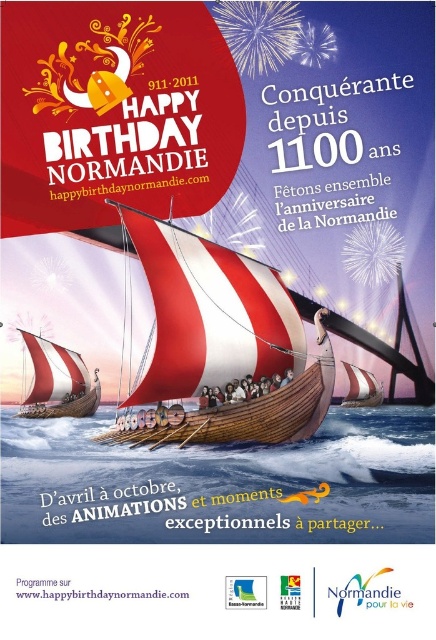
Question: Is wooden viking ship at center closer to camera compared to red and white striped sailboat at center?

Choices:
 (A) yes
 (B) no

Answer: (A)

Question: Is wooden viking ship at center to the right of white striped sailboat at center from the viewer's perspective?

Choices:
 (A) no
 (B) yes

Answer: (B)

Question: Among these objects, which one is nearest to the camera?

Choices:
 (A) white striped sailboat at center
 (B) red and white striped sailboat at center

Answer: (B)

Question: Which point appears farthest from the camera in this image?

Choices:
 (A) (64, 412)
 (B) (305, 355)
 (C) (357, 406)

Answer: (A)

Question: From the image, what is the correct spatial relationship of wooden viking ship at center in relation to white striped sailboat at center?

Choices:
 (A) above
 (B) below

Answer: (A)

Question: Which point is closer to the camera taking this photo?

Choices:
 (A) (41, 364)
 (B) (116, 208)

Answer: (B)